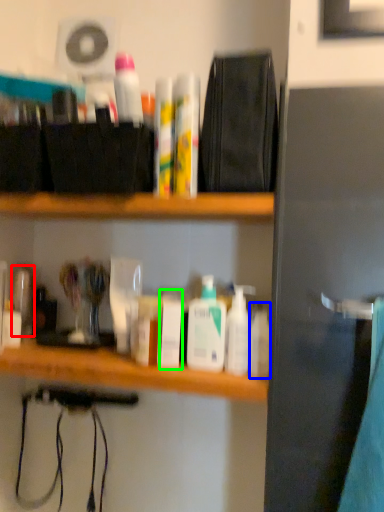
Question: Which is nearer to the toiletry (highlighted by a red box)? toiletry (highlighted by a blue box) or toiletry (highlighted by a green box).

Choices:
 (A) toiletry
 (B) toiletry

Answer: (B)